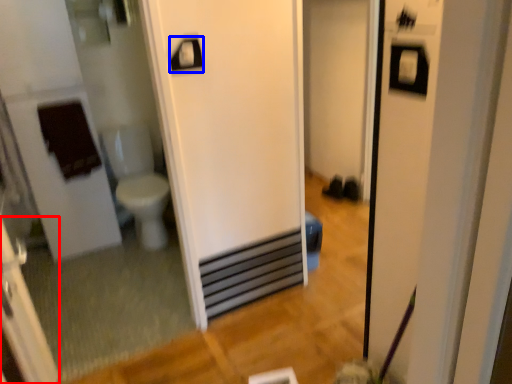
Question: Which object appears farthest to the camera in this image, screen door (highlighted by a red box) or towel bar (highlighted by a blue box)?

Choices:
 (A) screen door
 (B) towel bar

Answer: (B)